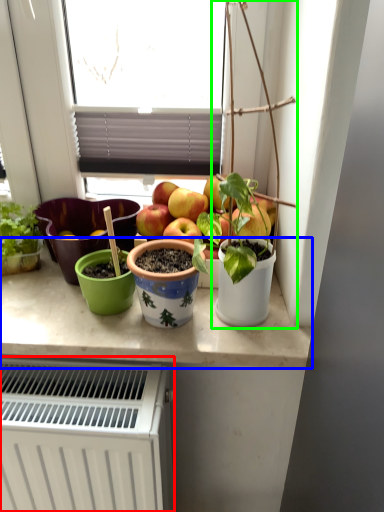
Question: Which object is the farthest from radiator (highlighted by a red box)? Choose among these: counter top (highlighted by a blue box) or houseplant (highlighted by a green box).

Choices:
 (A) counter top
 (B) houseplant

Answer: (B)